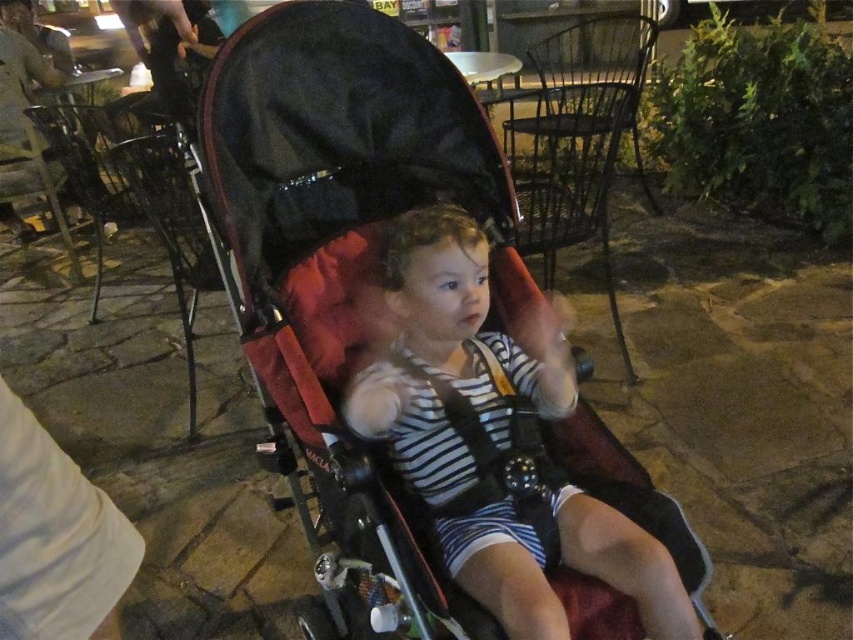
You are a delivery person trying to navigate through the outdoor dining area at night. You need to pass between the red fabric stroller at center and the striped fabric toddler at center. Can you estimate if there is enough space for your 1.2 meter wide delivery cart?

The red fabric stroller at center might be wider than striped fabric toddler at center, so it is uncertain if there is enough space for the 1.2 meter wide delivery cart. You should check the actual width before proceeding.

You are a photographer setting up for a night shoot in the outdoor dining area. You have two points marked in your viewfinder at coordinates point (x=293, y=301) and point (x=410, y=481). Which point is closer to the camera?

Point (x=410, y=481) is closer to the camera because it is less further than point (x=293, y=301), which is further away.

You are a parent trying to push your child in the stroller. The red fabric stroller at center is in front of the striped fabric toddler at center. Can you easily push the stroller forward without the toddler getting in the way?

The striped fabric toddler at center is behind the red fabric stroller at center, so pushing the stroller forward won